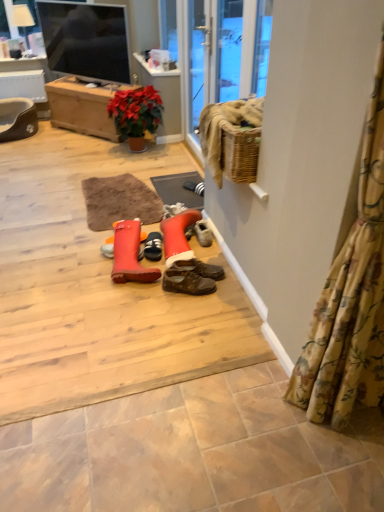
Question: Can matte beige tile at lower center be found inside brown leather shoes at center, the 1th footwear from the right?

Choices:
 (A) no
 (B) yes

Answer: (A)

Question: Can you confirm if brown leather shoes at center, the 1th footwear from the right, is wider than matte beige tile at lower center?

Choices:
 (A) yes
 (B) no

Answer: (B)

Question: Is brown leather shoes at center, the 1th footwear from the right, facing towards matte beige tile at lower center?

Choices:
 (A) yes
 (B) no

Answer: (B)

Question: Can you confirm if brown leather shoes at center, the 1th footwear from the right, is thinner than matte beige tile at lower center?

Choices:
 (A) yes
 (B) no

Answer: (A)

Question: Is brown leather shoes at center, the 1th footwear from the right, closer to camera compared to matte beige tile at lower center?

Choices:
 (A) yes
 (B) no

Answer: (B)

Question: Is brown leather shoes at center, the 1th footwear from the right, smaller than matte beige tile at lower center?

Choices:
 (A) yes
 (B) no

Answer: (A)

Question: From a real-world perspective, does matte beige tile at lower center sit lower than rubberized orange boot at center, which is the 1th footwear from left to right?

Choices:
 (A) no
 (B) yes

Answer: (B)

Question: Is matte beige tile at lower center further to the viewer compared to rubberized orange boot at center, which ranks as the third footwear in right-to-left order?

Choices:
 (A) yes
 (B) no

Answer: (B)

Question: Considering the relative sizes of matte beige tile at lower center and rubberized orange boot at center, which is the 1th footwear from left to right, in the image provided, is matte beige tile at lower center taller than rubberized orange boot at center, which is the 1th footwear from left to right,?

Choices:
 (A) yes
 (B) no

Answer: (B)

Question: Is matte beige tile at lower center positioned with its back to rubberized orange boot at center, which ranks as the third footwear in right-to-left order?

Choices:
 (A) no
 (B) yes

Answer: (A)

Question: From a real-world perspective, is matte beige tile at lower center over rubberized orange boot at center, which is the 1th footwear from left to right?

Choices:
 (A) yes
 (B) no

Answer: (B)

Question: Is the surface of matte beige tile at lower center in direct contact with rubberized orange boot at center, which is the 1th footwear from left to right?

Choices:
 (A) no
 (B) yes

Answer: (A)

Question: Is matte beige tile at lower center wider than brown leather shoes at center, the third footwear from the left?

Choices:
 (A) no
 (B) yes

Answer: (B)